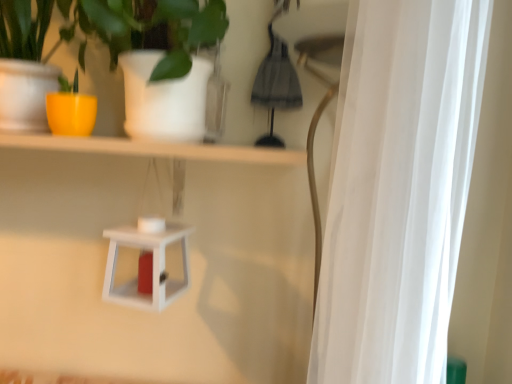
Question: Does yellow matte pot at left have a greater width compared to white sheer curtain at right?

Choices:
 (A) no
 (B) yes

Answer: (B)

Question: Does yellow matte pot at left have a lesser height compared to white sheer curtain at right?

Choices:
 (A) no
 (B) yes

Answer: (B)

Question: Is yellow matte pot at left outside of white sheer curtain at right?

Choices:
 (A) no
 (B) yes

Answer: (B)

Question: From the image's perspective, is yellow matte pot at left located beneath white sheer curtain at right?

Choices:
 (A) yes
 (B) no

Answer: (B)

Question: Can you confirm if yellow matte pot at left is smaller than white sheer curtain at right?

Choices:
 (A) yes
 (B) no

Answer: (A)

Question: In the image, is yellow matte pot at left positioned in front of or behind white sheer curtain at right?

Choices:
 (A) behind
 (B) front

Answer: (A)

Question: In terms of width, does yellow matte pot at left look wider or thinner when compared to white sheer curtain at right?

Choices:
 (A) thin
 (B) wide

Answer: (B)

Question: Considering the positions of yellow matte pot at left and white sheer curtain at right in the image, is yellow matte pot at left bigger or smaller than white sheer curtain at right?

Choices:
 (A) small
 (B) big

Answer: (A)

Question: Is yellow matte pot at left to the left or to the right of white sheer curtain at right in the image?

Choices:
 (A) left
 (B) right

Answer: (A)

Question: Considering the positions of point (150, 307) and point (424, 87), is point (150, 307) closer or farther from the camera than point (424, 87)?

Choices:
 (A) farther
 (B) closer

Answer: (A)

Question: From their relative heights in the image, would you say white matte lantern at center is taller or shorter than white sheer curtain at right?

Choices:
 (A) tall
 (B) short

Answer: (B)

Question: Is white matte lantern at center inside or outside of white sheer curtain at right?

Choices:
 (A) outside
 (B) inside

Answer: (A)

Question: Looking at their shapes, would you say white matte lantern at center is wider or thinner than white sheer curtain at right?

Choices:
 (A) thin
 (B) wide

Answer: (B)

Question: Looking at their shapes, would you say white sheer curtain at right is wider or thinner than white matte lantern at center?

Choices:
 (A) wide
 (B) thin

Answer: (B)

Question: Is point (432, 82) positioned closer to the camera than point (158, 292)?

Choices:
 (A) closer
 (B) farther

Answer: (A)